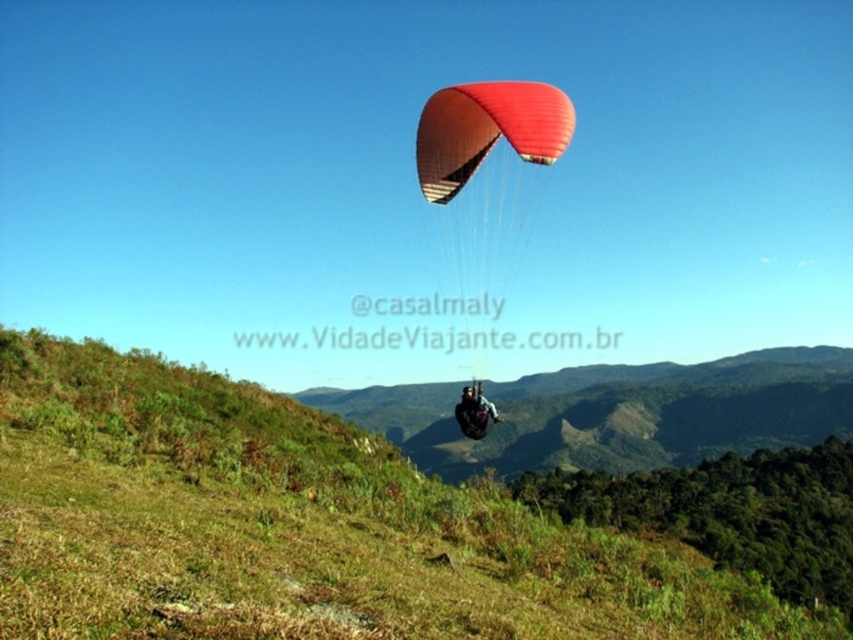
Question: Is matte red parachute at center bigger than matte black helmet at center?

Choices:
 (A) no
 (B) yes

Answer: (A)

Question: Which point appears farthest from the camera in this image?

Choices:
 (A) (503, 92)
 (B) (474, 436)

Answer: (B)

Question: Which of the following is the closest to the observer?

Choices:
 (A) (482, 410)
 (B) (619, 545)

Answer: (B)

Question: Among these points, which one is nearest to the camera?

Choices:
 (A) (625, 595)
 (B) (494, 416)

Answer: (A)

Question: Is matte red parachute at center behind matte black helmet at center?

Choices:
 (A) yes
 (B) no

Answer: (B)

Question: Can you confirm if matte red parachute at center is smaller than matte black helmet at center?

Choices:
 (A) yes
 (B) no

Answer: (A)